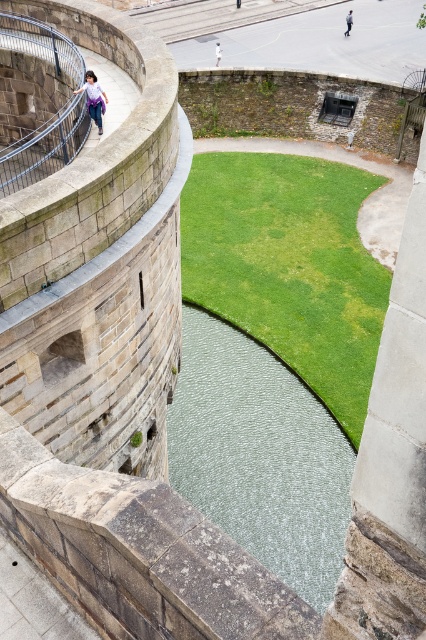
Is green grass at center to the left of white cotton shirt at upper left from the viewer's perspective?

No, green grass at center is not to the left of white cotton shirt at upper left.

Which is behind, point (281, 154) or point (219, 48)?

Positioned behind is point (219, 48).

Does point (209, 227) come in front of point (218, 45)?

Yes, it is in front of point (218, 45).

Find the location of a particular element. The height and width of the screenshot is (640, 426). green grass at center is located at coordinates (288, 266).

Looking at this image, can you confirm if rustic metal balustrade at upper left is shorter than denim pants at upper left?

No.

Can you confirm if rustic metal balustrade at upper left is wider than denim pants at upper left?

Yes, rustic metal balustrade at upper left is wider than denim pants at upper left.

Does point (55, 125) come farther from viewer compared to point (104, 106)?

No, it is in front of (104, 106).

Identify the location of rustic metal balustrade at upper left. (45, 147).

Which is more to the left, denim pants at upper left or light blue jeans at center?

Positioned to the left is denim pants at upper left.

Between point (103, 99) and point (345, 33), which one is positioned in front?

Point (103, 99) is more forward.

Is point (92, 92) positioned behind point (351, 17)?

No, (92, 92) is closer to viewer.

This screenshot has height=640, width=426. I want to click on denim pants at upper left, so click(x=94, y=99).